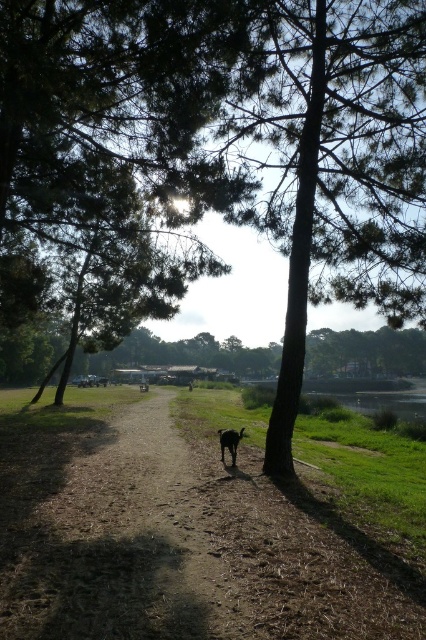
Between brown dirt path at center and green leafy tree at center, which one is positioned lower?

Positioned lower is brown dirt path at center.

Locate an element on the screen. The height and width of the screenshot is (640, 426). brown dirt path at center is located at coordinates (167, 538).

Where is `brown dirt path at center`? This screenshot has width=426, height=640. brown dirt path at center is located at coordinates (167, 538).

In the scene shown: Is brown dirt path at center positioned in front of black fur dog at center?

Yes, brown dirt path at center is closer to the viewer.

Locate an element on the screen. The height and width of the screenshot is (640, 426). brown dirt path at center is located at coordinates (167, 538).

How far apart are green leafy tree at center and black fur dog at center?

7.93 meters

Which is behind, point (103, 65) or point (241, 435)?

Positioned behind is point (241, 435).

You are a GUI agent. You are given a task and a screenshot of the screen. Output one action in this format:
    pyautogui.click(x=<x>, y=<y>)
    Task: Click on the green leafy tree at center
    The image size is (426, 640).
    Given the screenshot: What is the action you would take?
    (x=115, y=145)